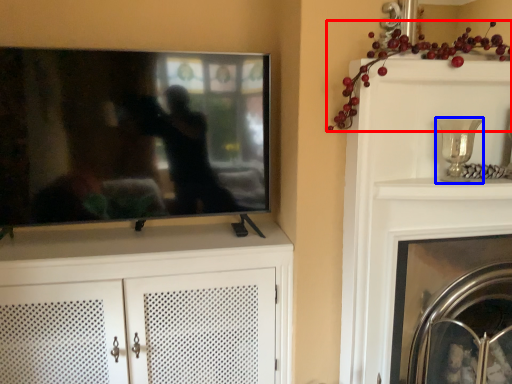
Question: Which point is further to the camera, fruit (highlighted by a red box) or candle holder (highlighted by a blue box)?

Choices:
 (A) fruit
 (B) candle holder

Answer: (B)